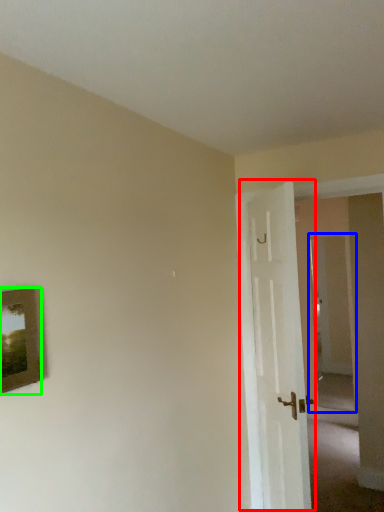
Question: Considering the real-world distances, which object is farthest from door (highlighted by a red box)? glass door (highlighted by a blue box) or picture frame (highlighted by a green box)?

Choices:
 (A) glass door
 (B) picture frame

Answer: (A)